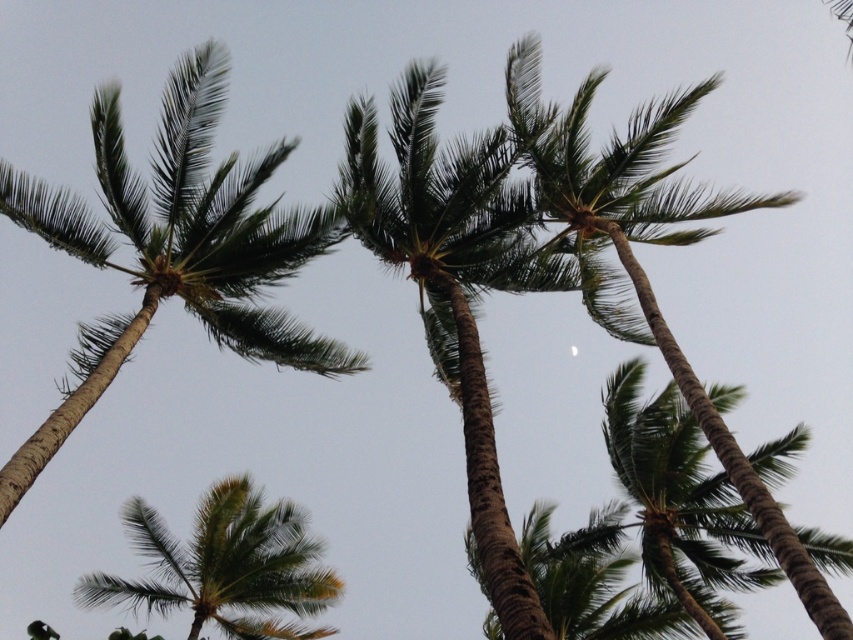
Question: Estimate the real-world distances between objects in this image. Which object is farther from the green textured palm tree at center?

Choices:
 (A) green leafy palm tree at center
 (B) green leafy palm tree at lower left
 (C) green leafy coconut tree at upper left

Answer: (B)

Question: Which of the following is the closest to the observer?

Choices:
 (A) (405, 124)
 (B) (79, 381)
 (C) (730, 568)

Answer: (B)

Question: Does green textured palm tree at upper right appear on the left side of green leafy palm tree at lower left?

Choices:
 (A) yes
 (B) no

Answer: (B)

Question: Can you confirm if green textured palm tree at upper right is bigger than green leafy palm tree at lower left?

Choices:
 (A) yes
 (B) no

Answer: (B)

Question: Does green textured palm tree at center appear on the left side of green textured palm tree at upper right?

Choices:
 (A) yes
 (B) no

Answer: (A)

Question: Estimate the real-world distances between objects in this image. Which object is closer to the green leafy coconut tree at upper left?

Choices:
 (A) green textured palm tree at upper right
 (B) green leafy palm tree at center
 (C) green textured palm tree at center
 (D) green leafy palm tree at lower left

Answer: (C)